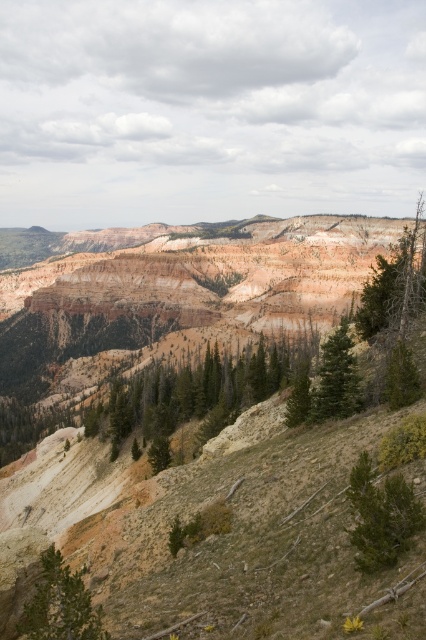
Is green matte tree at lower left wider than green matte tree at center?

Yes, green matte tree at lower left is wider than green matte tree at center.

Does green matte tree at lower left lie in front of green matte tree at center?

Yes, green matte tree at lower left is in front of green matte tree at center.

Which is in front, point (57, 557) or point (293, 420)?

Point (57, 557)

Identify the location of green matte tree at lower left. (60, 604).

Which is behind, point (209, 429) or point (353, 410)?

The point (209, 429) is behind.

Is green textured tree at center below green matte tree at center-right?

Yes, green textured tree at center is below green matte tree at center-right.

Measure the distance between green textured tree at center and camera.

green textured tree at center and camera are 302.10 feet apart from each other.

The image size is (426, 640). Identify the location of green textured tree at center. (195, 392).

Is green matte tree at center-right above green matte tree at center?

Correct, green matte tree at center-right is located above green matte tree at center.

Is point (339, 381) farther from camera compared to point (299, 420)?

No, (339, 381) is closer to viewer.

Which is behind, point (345, 410) or point (296, 385)?

Positioned behind is point (296, 385).

Where is `green matte tree at center-right`? The image size is (426, 640). green matte tree at center-right is located at coordinates (336, 378).